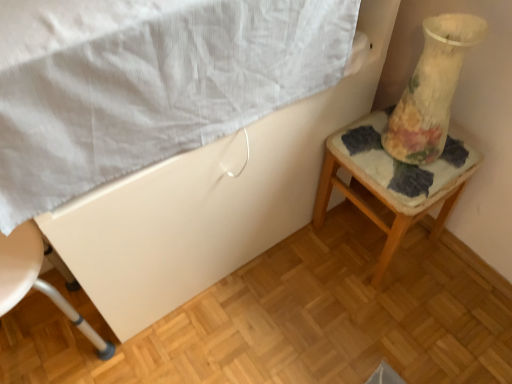
This screenshot has width=512, height=384. Find the location of `blank area beneath white plastic chair at lower left (from a real-world perspective)`. blank area beneath white plastic chair at lower left (from a real-world perspective) is located at coordinates (48, 346).